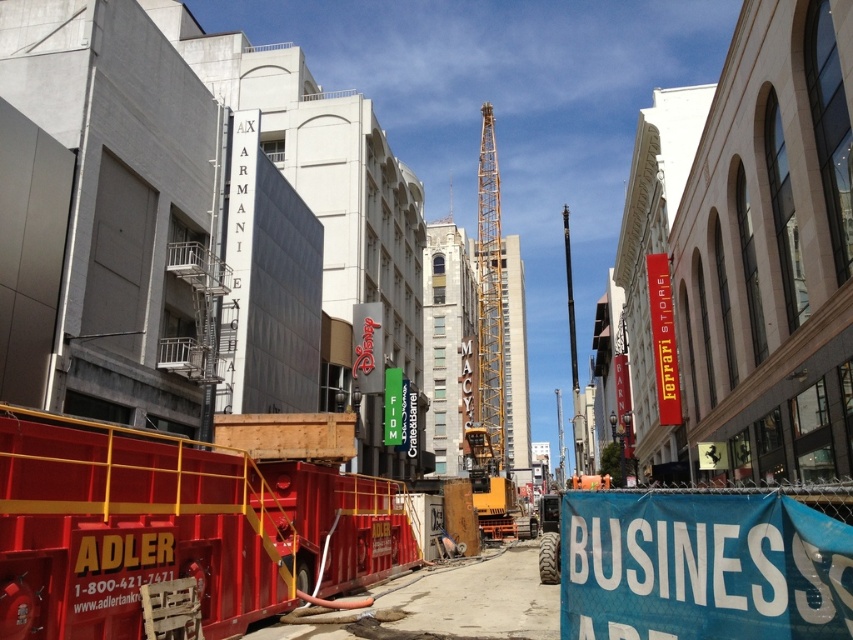
What is the exact coordinate of the blue fabric sign at lower right?

The blue fabric sign at lower right is located at coordinate point (701, 566).

You are a delivery driver who just arrived at the construction site. You need to locate the blue fabric sign at lower right and the yellow metallic crane at center. According to the scene, which object is positioned to the left of the other?

The blue fabric sign at lower right is to the left of the yellow metallic crane at center.

You are a city planner assessing the construction site. You need to determine if the blue fabric sign at lower right can be placed on a wall that can only accommodate items narrower than the yellow metallic crane at center. Based on the scene, can the sign fit?

The blue fabric sign at lower right has a width less than the yellow metallic crane at center, so it can fit on the wall since its width is narrower than the crane.